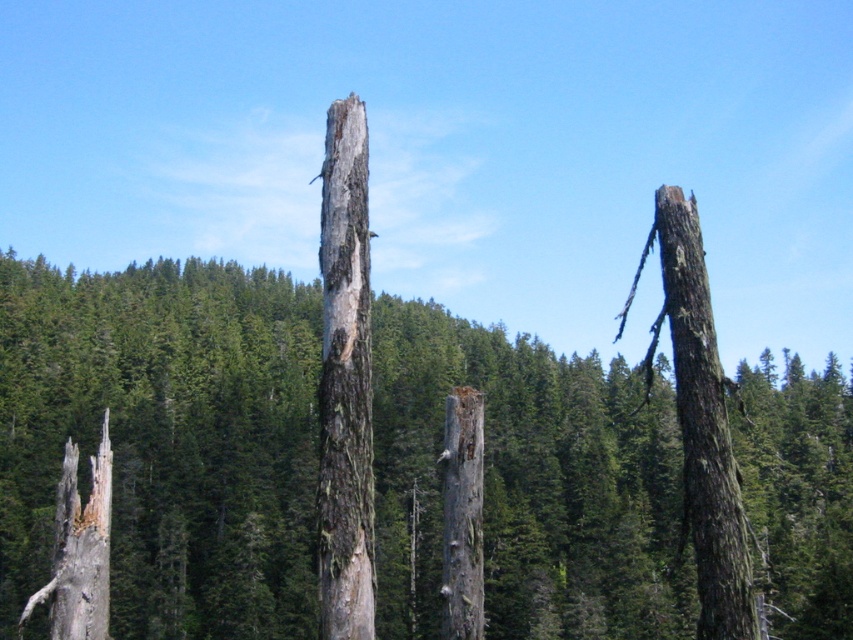
Is point (263, 627) positioned after point (693, 273)?

Yes, it is.

Can you confirm if green rough bark at center is wider than dark brown rough bark tree trunk at right?

Correct, the width of green rough bark at center exceeds that of dark brown rough bark tree trunk at right.

Identify the location of green rough bark at center. This screenshot has height=640, width=853. (166, 438).

Which is above, dark brown rough bark tree trunk at right or gray rough bark tree trunk at center?

gray rough bark tree trunk at center is above.

Does dark brown rough bark tree trunk at right appear under gray rough bark tree trunk at center?

Indeed, dark brown rough bark tree trunk at right is positioned under gray rough bark tree trunk at center.

Does point (704, 371) come behind point (473, 625)?

No, (704, 371) is in front of (473, 625).

I want to click on dark brown rough bark tree trunk at right, so (x=703, y=426).

Which is more to the right, green rough bark at center or gray rough bark tree trunk at center?

Positioned to the right is green rough bark at center.

How much distance is there between green rough bark at center and gray rough bark tree trunk at center?

green rough bark at center is 120.88 meters away from gray rough bark tree trunk at center.

Between point (102, 340) and point (445, 416), which one is positioned behind?

Point (102, 340)

Where is `green rough bark at center`? The image size is (853, 640). green rough bark at center is located at coordinates (166, 438).